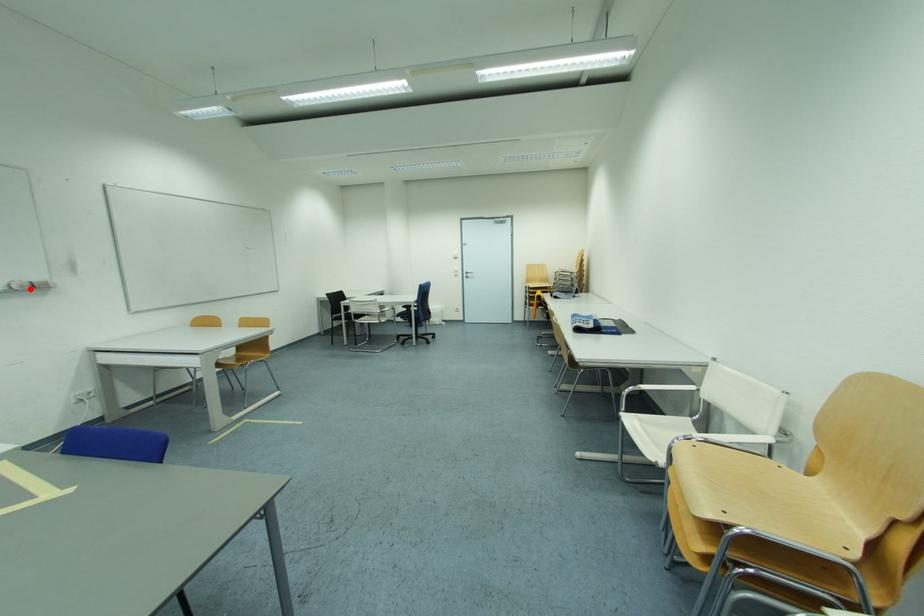
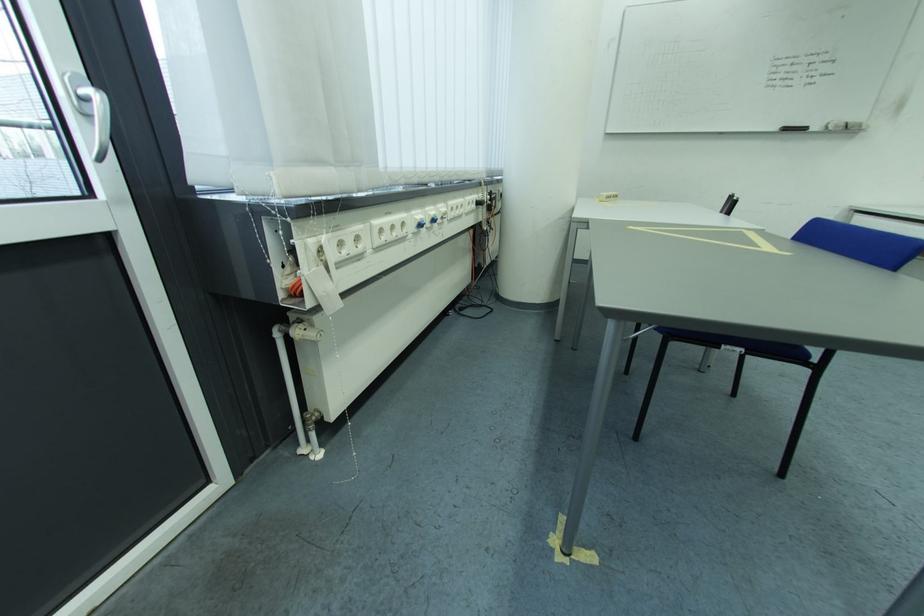
Question: I am providing you with two images of the same scene from different viewpoints. A red point is marked on the first image. At the location where the point appears in image 1, is it still visible in image 2?

Choices:
 (A) Yes
 (B) No

Answer: (A)